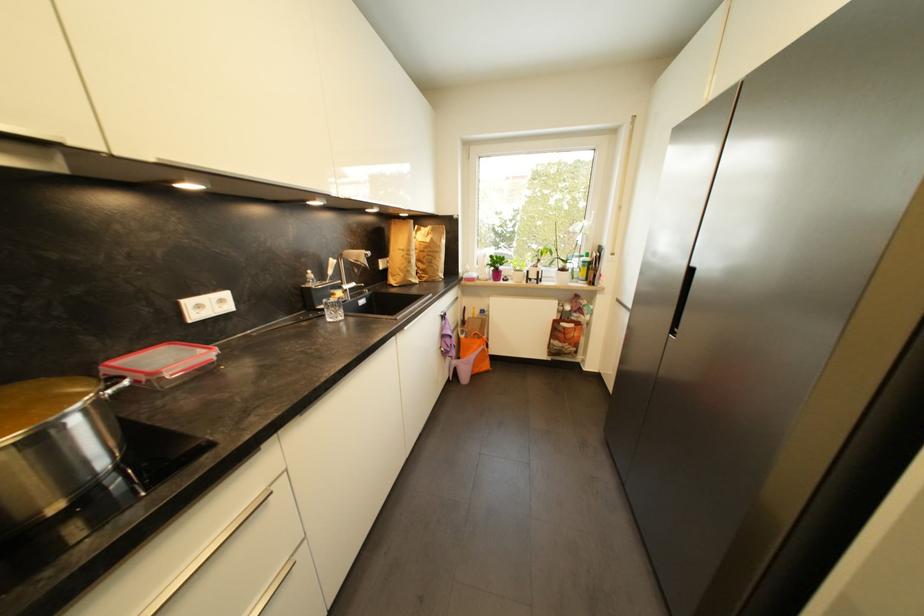
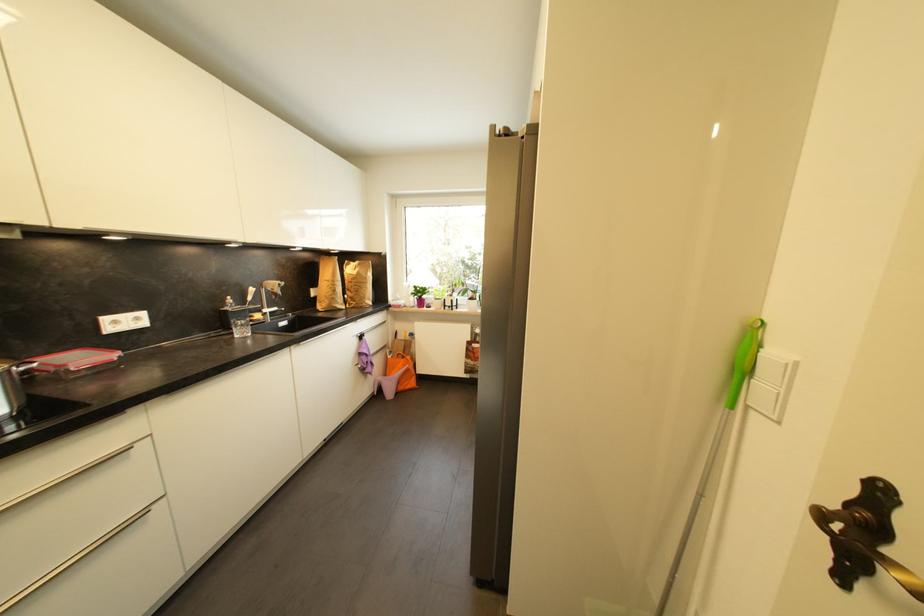
Question: The images are taken continuously from a first-person perspective. In which direction is your viewpoint rotating?

Choices:
 (A) Left
 (B) Right
 (C) Up
 (D) Down

Answer: (C)